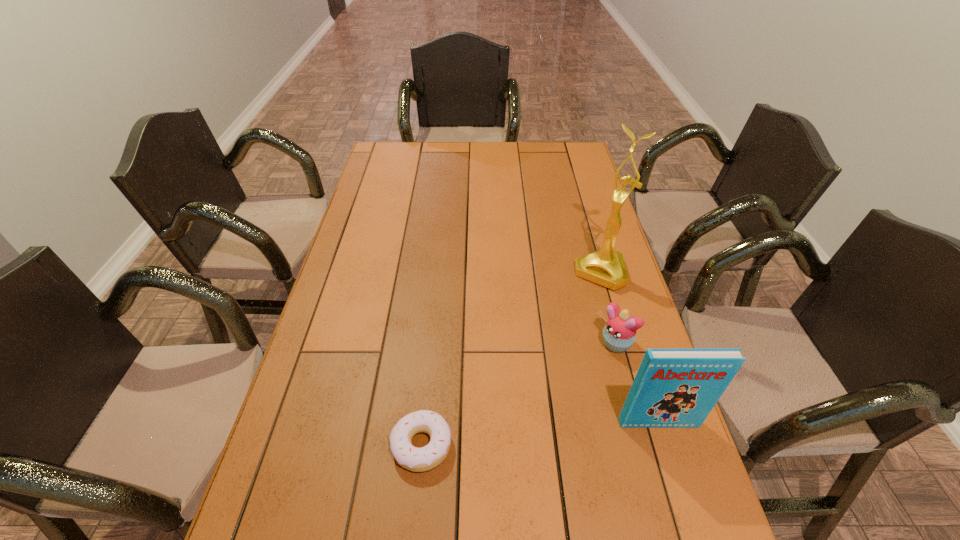
The image size is (960, 540). What are the coordinates of `vacant space at the right edge` in the screenshot? It's located at (583, 215).

Where is `blank space at the far left corner`? The width and height of the screenshot is (960, 540). blank space at the far left corner is located at coordinates (404, 146).

Identify the location of free space between the third shortest object and the doughnut. The height and width of the screenshot is (540, 960). (540, 434).

Locate an element on the screen. This screenshot has height=540, width=960. vacant area that lies between the doughnut and the third nearest object is located at coordinates (517, 396).

Find the location of a particular element. vacant area between the book and the shortest object is located at coordinates (540, 434).

At what (x,y) coordinates should I click in order to perform the action: click on free point between the third shortest object and the leftmost object. Please return your answer as a coordinate pair (x, y). The height and width of the screenshot is (540, 960). Looking at the image, I should click on (540, 434).

This screenshot has width=960, height=540. I want to click on object that is the third nearest to the farthest object, so click(415, 459).

Locate an element on the screen. The width and height of the screenshot is (960, 540). object that is the third closest to the book is located at coordinates (606, 267).

Find the location of a particular element. vacant space that satisfies the following two spatial constraints: 1. on the back side of the award; 2. on the right side of the doughnut is located at coordinates (439, 272).